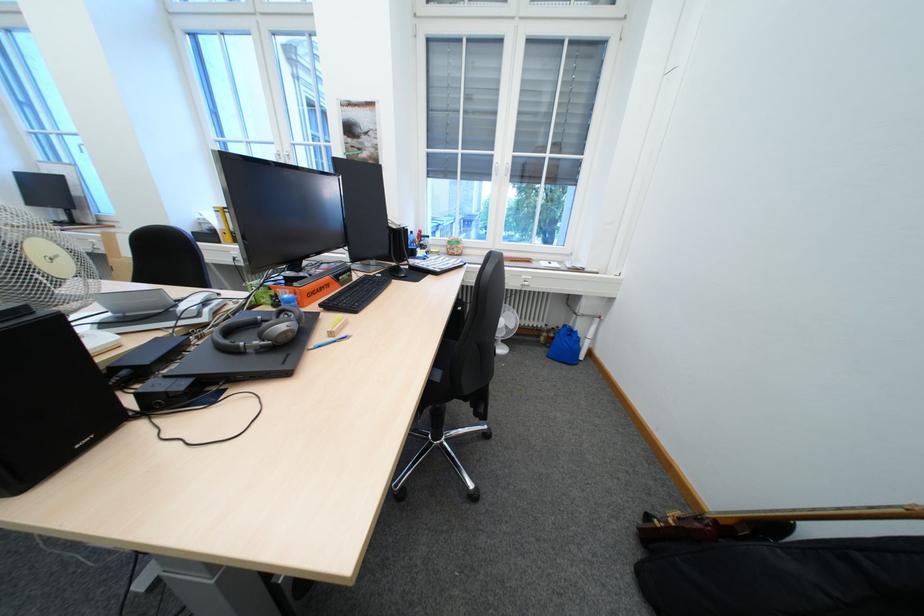
Describe the element at coordinates (503, 169) in the screenshot. I see `the white window handle` at that location.